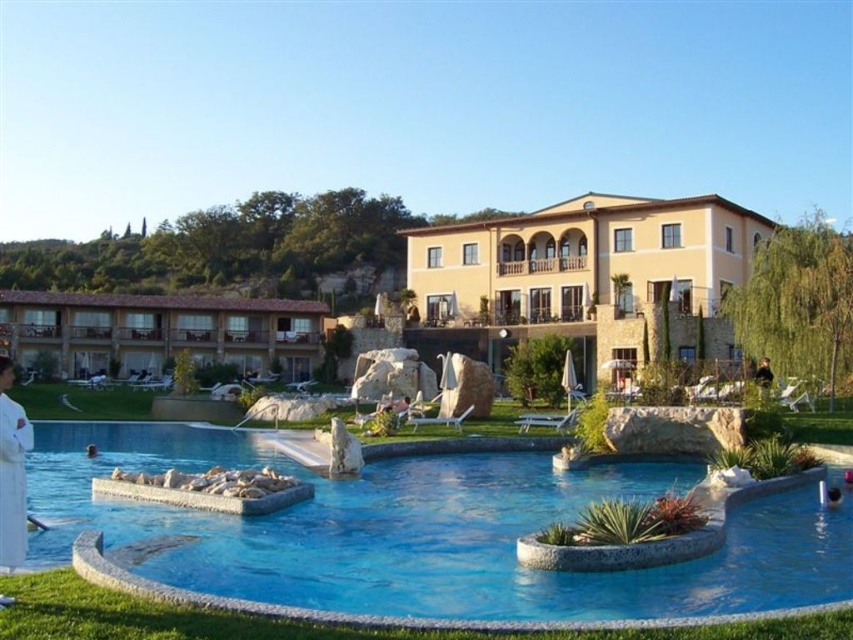
Is point (409, 272) farther from camera compared to point (1, 454)?

Yes, point (409, 272) is behind point (1, 454).

Between point (711, 296) and point (9, 477), which one is positioned in front?

Point (9, 477) is more forward.

Identify the location of beige stucco building at center. (583, 259).

The height and width of the screenshot is (640, 853). In order to click on beige stucco building at center in this screenshot , I will do `click(583, 259)`.

Which of these two, blue stone pool at center or brown tile roof resort at left, stands taller?

Standing taller between the two is brown tile roof resort at left.

Which is more to the right, blue stone pool at center or brown tile roof resort at left?

Positioned to the right is blue stone pool at center.

Between point (572, 588) and point (177, 307), which one is positioned in front?

Point (572, 588) is more forward.

Where is `blue stone pool at center`? The image size is (853, 640). blue stone pool at center is located at coordinates (422, 532).

Can you confirm if blue stone pool at center is wider than white cotton robe at lower left?

Yes.

Is blue stone pool at center bigger than white cotton robe at lower left?

Yes.

Find the location of a particular element. The width and height of the screenshot is (853, 640). blue stone pool at center is located at coordinates (422, 532).